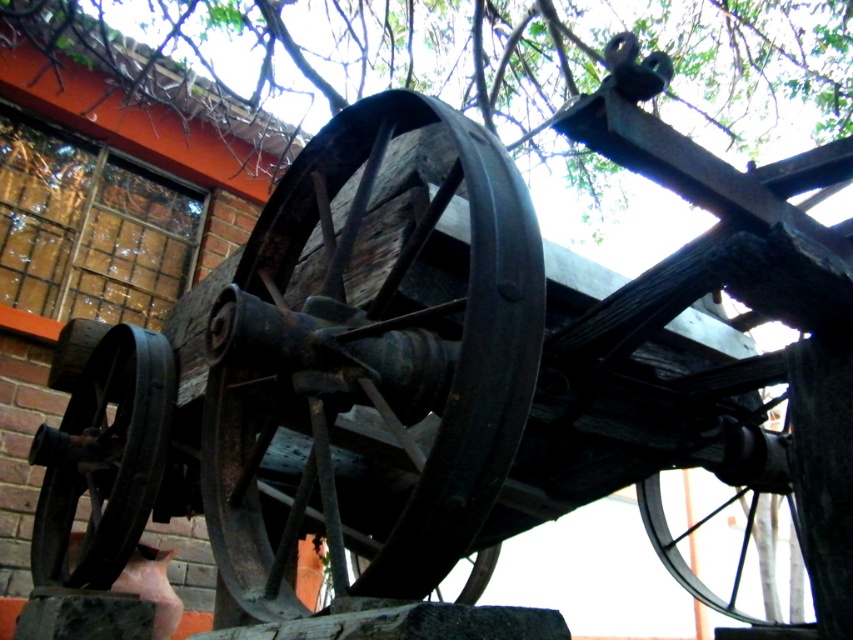
Question: Among these points, which one is farthest from the camera?

Choices:
 (A) (498, 176)
 (B) (97, 401)
 (C) (482, 556)
 (D) (547, 35)

Answer: (D)

Question: Can you confirm if green wood tree at upper center is bigger than rusty metal wheel at lower left?

Choices:
 (A) yes
 (B) no

Answer: (A)

Question: Estimate the real-world distances between objects in this image. Which object is closer to the rusty metal wheel at lower center?

Choices:
 (A) rusty metal wheel at lower left
 (B) rusty metal wheel at center

Answer: (A)

Question: Is green wood tree at upper center above rusty metal wheel at lower left?

Choices:
 (A) yes
 (B) no

Answer: (A)

Question: Does green wood tree at upper center come in front of rusty metal wheel at lower left?

Choices:
 (A) yes
 (B) no

Answer: (B)

Question: Which of the following is the closest to the observer?

Choices:
 (A) (65, 449)
 (B) (657, 35)

Answer: (A)